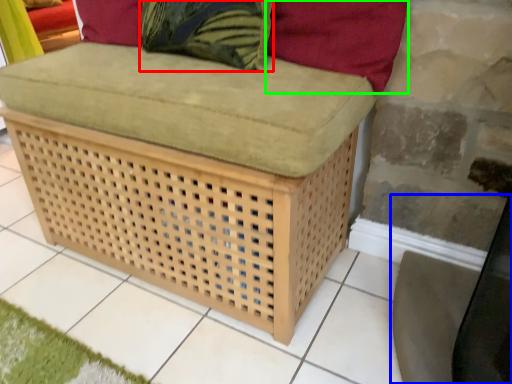
Question: Based on their relative distances, which object is farther from throw pillow (highlighted by a red box)? Choose from swivel chair (highlighted by a blue box) and pillow (highlighted by a green box).

Choices:
 (A) swivel chair
 (B) pillow

Answer: (A)